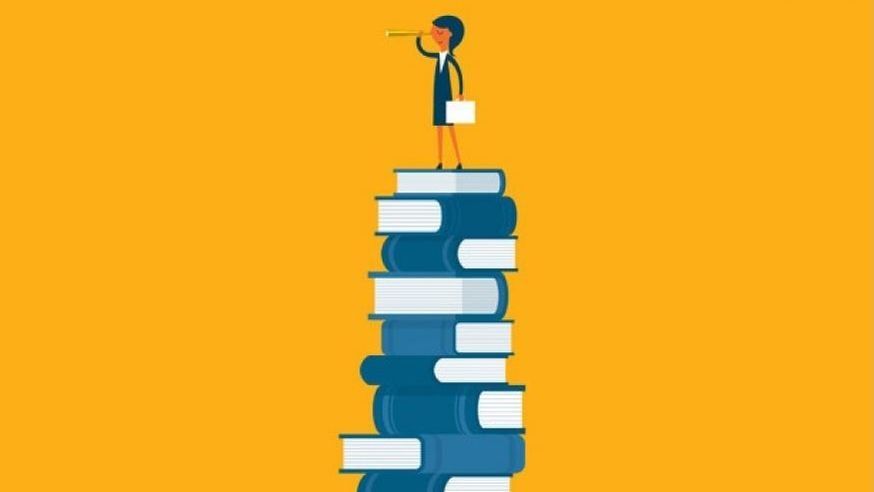
Where is `books`? The width and height of the screenshot is (874, 492). books is located at coordinates (451, 484), (447, 461), (454, 415), (429, 374), (441, 344), (454, 301), (451, 252), (451, 216), (454, 187).